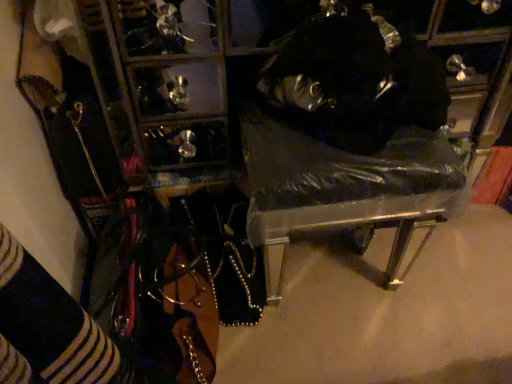
This screenshot has width=512, height=384. Find the location of `vacant space to the right of clear plastic bag at center`. vacant space to the right of clear plastic bag at center is located at coordinates (465, 280).